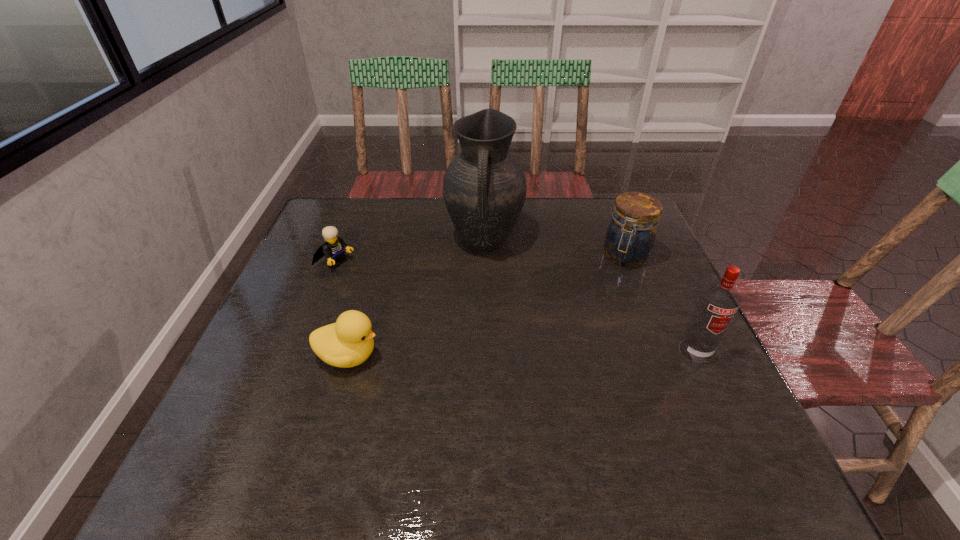
You are a GUI agent. You are given a task and a screenshot of the screen. Output one action in this format:
    pyautogui.click(x=<x>, y=<y>)
    Task: Click on the vacant space located 0.230m on the front-facing side of the Lego
    This screenshot has width=960, height=540.
    Given the screenshot: What is the action you would take?
    pyautogui.click(x=414, y=301)

In order to click on vacant space positioned on the side of the pitcher with the handle in this screenshot , I will do `click(479, 305)`.

I want to click on vacant region located on the side of the pitcher with the handle, so click(481, 280).

This screenshot has width=960, height=540. I want to click on free spot located 0.380m on the side of the pitcher with the handle, so click(473, 387).

You are a GUI agent. You are given a task and a screenshot of the screen. Output one action in this format:
    pyautogui.click(x=<x>, y=<y>)
    Task: Click on the vacant space located on the lid of the third tallest object
    
    Given the screenshot: What is the action you would take?
    pyautogui.click(x=567, y=357)

Find the location of a particular element. blank space located on the lid of the third tallest object is located at coordinates (571, 351).

Find the location of a particular element. The width and height of the screenshot is (960, 540). vacant area located on the lid of the third tallest object is located at coordinates (593, 313).

The image size is (960, 540). I want to click on object situated at the far edge, so click(x=484, y=189).

Locate an element on the screen. duck that is at the left edge is located at coordinates (349, 342).

At what (x,y) coordinates should I click in order to perform the action: click on Lego present at the left edge. Please return your answer as a coordinate pair (x, y). Looking at the image, I should click on (333, 249).